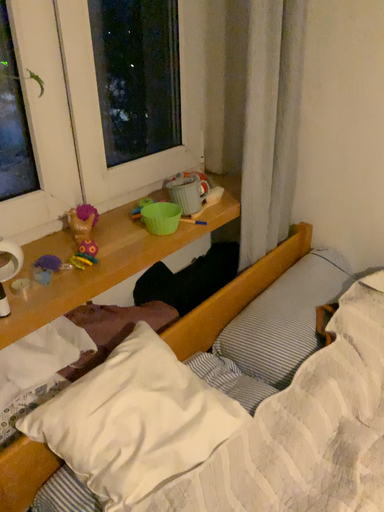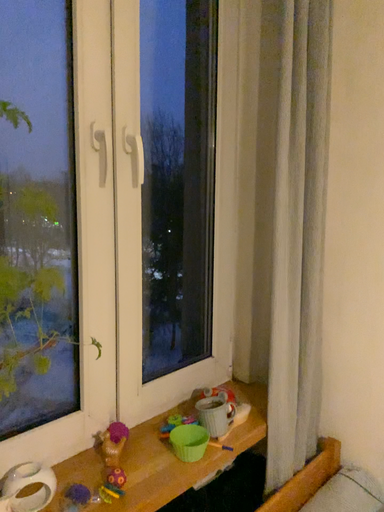
Question: Which way did the camera rotate in the video?

Choices:
 (A) rotated upward
 (B) rotated downward

Answer: (A)